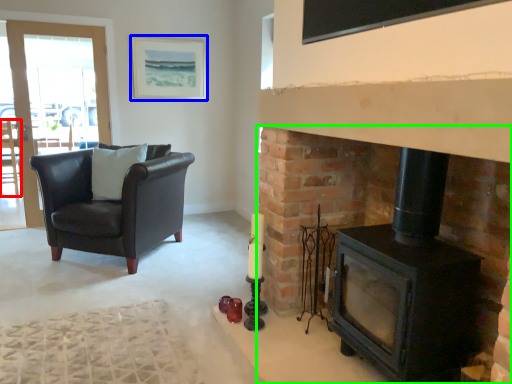
Question: Which object is the farthest from chair (highlighted by a red box)? Choose among these: picture frame (highlighted by a blue box) or fireplace (highlighted by a green box).

Choices:
 (A) picture frame
 (B) fireplace

Answer: (B)